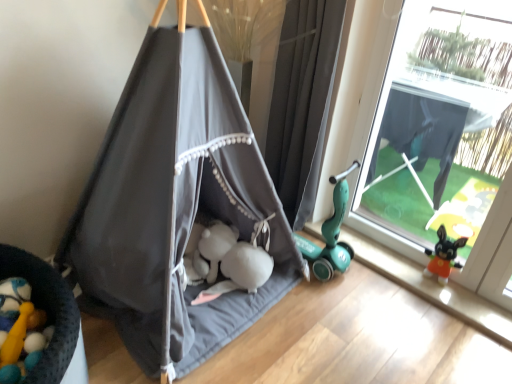
Question: In terms of height, does gray fabric curtain at right look taller or shorter compared to dark gray fabric tent at center?

Choices:
 (A) tall
 (B) short

Answer: (B)

Question: Is gray fabric curtain at right wider or thinner than dark gray fabric tent at center?

Choices:
 (A) thin
 (B) wide

Answer: (A)

Question: Based on their relative distances, which object is nearer to the transparent plastic window at right?

Choices:
 (A) gray fabric curtain at right
 (B) dark gray fabric tent at center

Answer: (A)

Question: Considering the real-world distances, which object is farthest from the transparent plastic window at right?

Choices:
 (A) gray fabric curtain at right
 (B) dark gray fabric tent at center

Answer: (B)